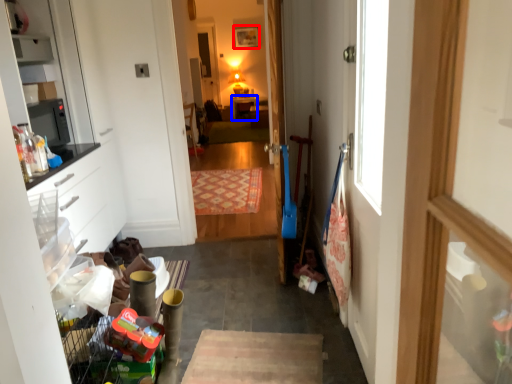
Question: Among these objects, which one is farthest to the camera, picture frame (highlighted by a red box) or table (highlighted by a blue box)?

Choices:
 (A) picture frame
 (B) table

Answer: (A)